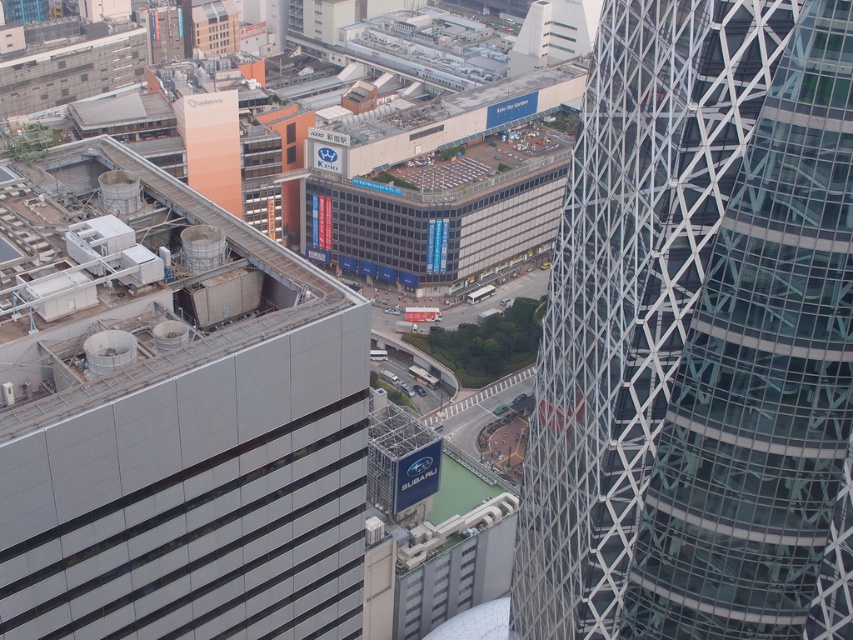
Measure the distance between glassy steel tower at right and metallic gray building at left.

glassy steel tower at right and metallic gray building at left are 23.15 meters apart.

Can you confirm if glassy steel tower at right is thinner than metallic gray building at left?

Yes.

Is point (601, 500) farther from camera compared to point (329, 346)?

Yes, it is.

Identify the location of glassy steel tower at right. The height and width of the screenshot is (640, 853). (695, 328).